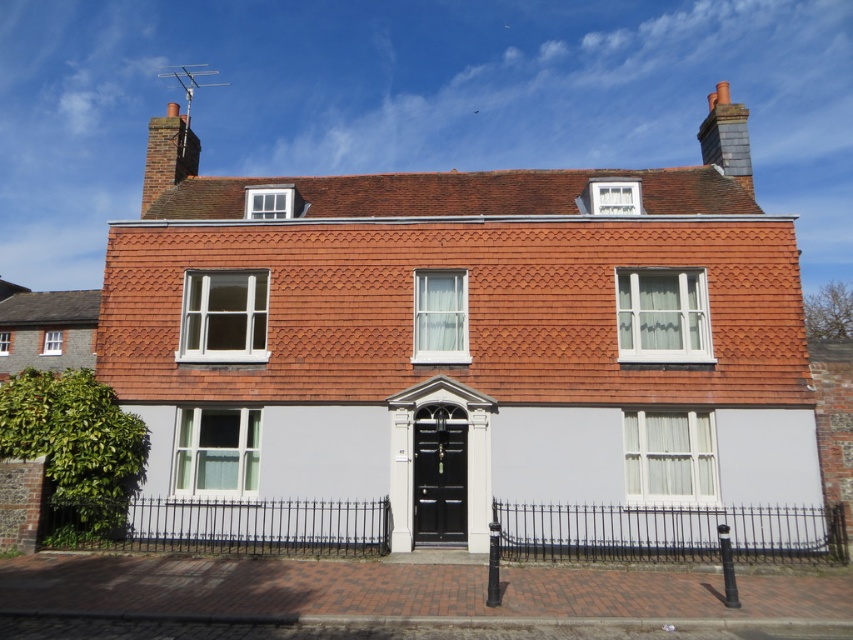
Question: Which point is closer to the camera?

Choices:
 (A) (129, 291)
 (B) (738, 154)

Answer: (A)

Question: Can you confirm if red brick chimney at upper left is positioned to the right of gray slate chimney at upper right?

Choices:
 (A) yes
 (B) no

Answer: (B)

Question: Does red brick chimney at upper left lie in front of gray slate chimney at upper right?

Choices:
 (A) yes
 (B) no

Answer: (A)

Question: Does red brick chimney at upper left have a lesser width compared to gray slate chimney at upper right?

Choices:
 (A) no
 (B) yes

Answer: (B)

Question: Which object is closer to the camera taking this photo?

Choices:
 (A) gray slate chimney at upper right
 (B) red brick chimney at upper left

Answer: (B)

Question: Which point is farther from the camera taking this photo?

Choices:
 (A) (706, 148)
 (B) (109, 291)

Answer: (A)